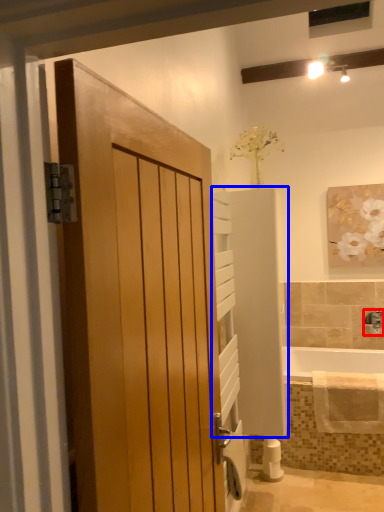
Question: Among these objects, which one is nearest to the camera, tap (highlighted by a red box) or elevator (highlighted by a blue box)?

Choices:
 (A) tap
 (B) elevator

Answer: (B)